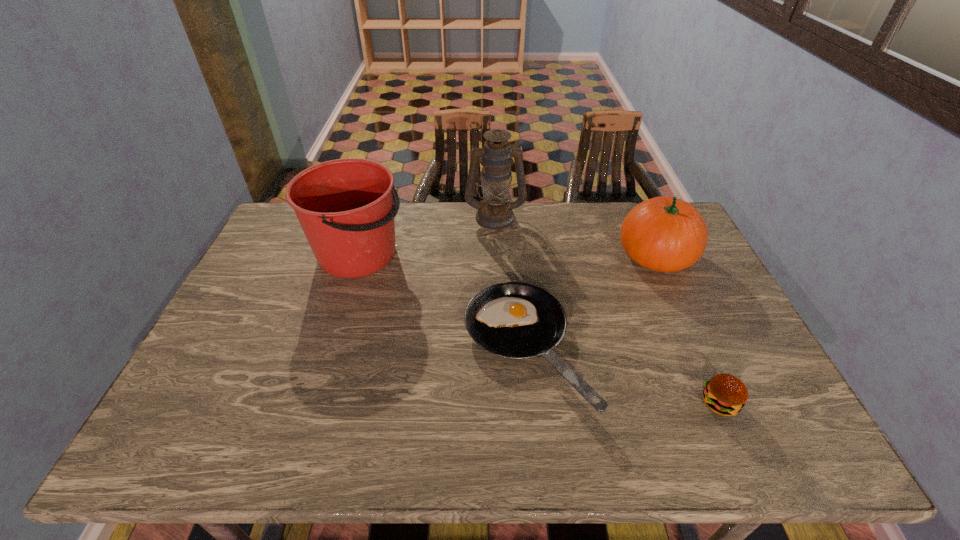
Find the location of a particular element. This screenshot has height=540, width=960. blank space at the left edge of the desktop is located at coordinates (280, 273).

The height and width of the screenshot is (540, 960). Identify the location of free space at the right edge of the desktop. (676, 295).

The image size is (960, 540). In order to click on vacant area that lies between the hamburger and the third tallest object in this screenshot , I will do `click(687, 329)`.

Identify the location of free space that is in between the third tallest object and the bucket. The width and height of the screenshot is (960, 540). (507, 255).

Locate an element on the screen. free space between the fourth tallest object and the frying pan is located at coordinates (622, 376).

This screenshot has height=540, width=960. Identify the location of empty space between the shortest object and the pumpkin. (591, 302).

Locate an element on the screen. The image size is (960, 540). empty space that is in between the frying pan and the pumpkin is located at coordinates (591, 302).

Find the location of `free space between the pumpkin and the oil lamp`. free space between the pumpkin and the oil lamp is located at coordinates (575, 236).

Find the location of `empty space between the third shortest object and the oil lamp`. empty space between the third shortest object and the oil lamp is located at coordinates (575, 236).

Locate an element on the screen. This screenshot has height=540, width=960. object identified as the closest to the third shortest object is located at coordinates (515, 320).